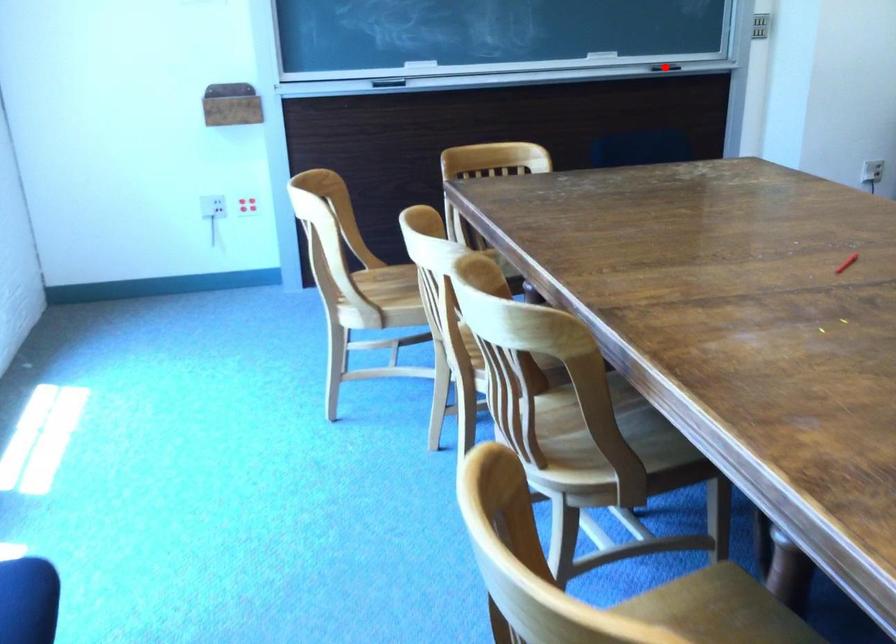
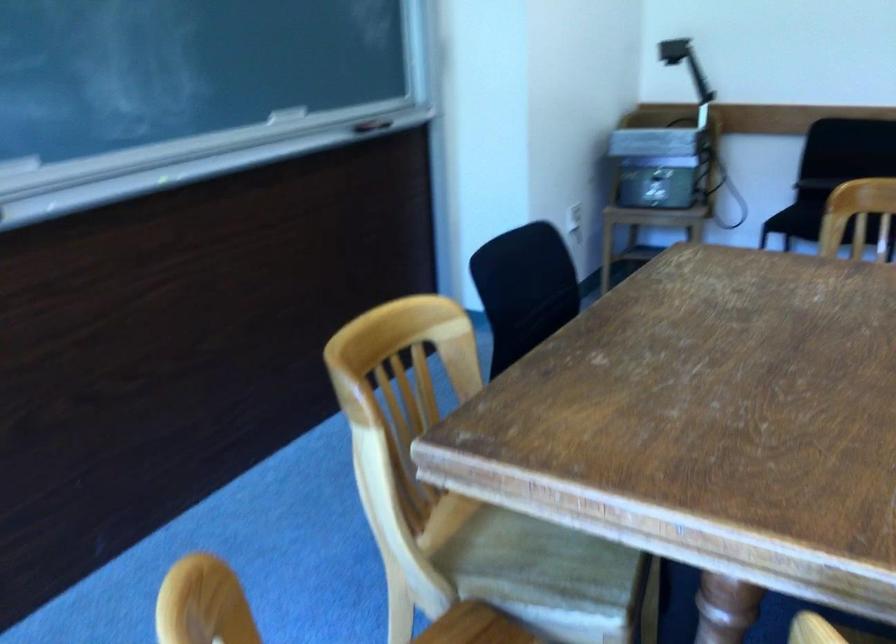
Question: I am providing you with two images of the same scene from different viewpoints. A red point is marked on the first image. At the location where the point appears in image 1, is it still visible in image 2?

Choices:
 (A) Yes
 (B) No

Answer: (B)